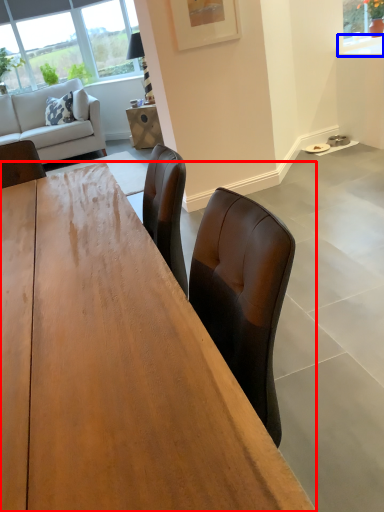
Question: Which object appears closest to the camera in this image, desk (highlighted by a red box) or counter top (highlighted by a blue box)?

Choices:
 (A) desk
 (B) counter top

Answer: (A)